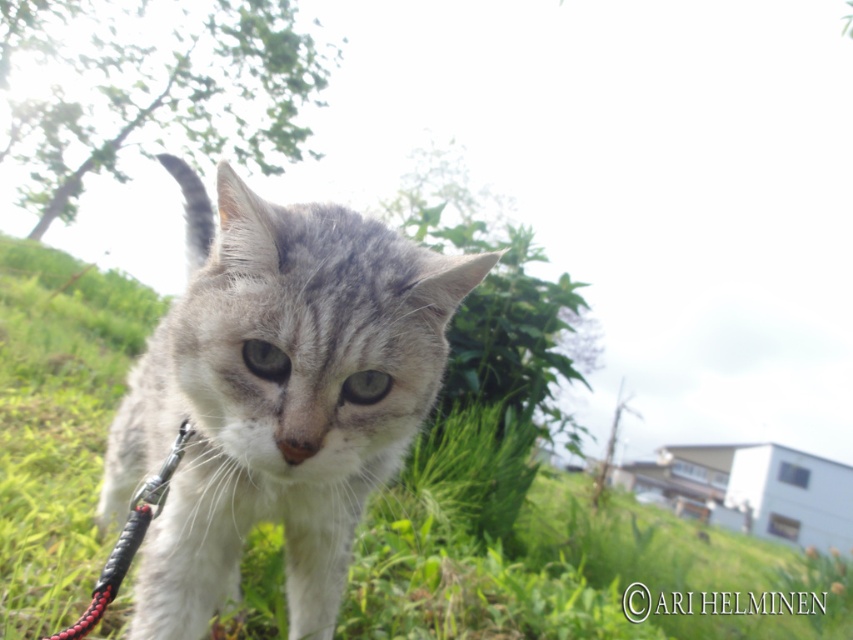
Can you confirm if green grassy at center is positioned to the right of gray fur cat at center?

Yes, green grassy at center is to the right of gray fur cat at center.

Which is more to the right, green grassy at center or gray fur cat at center?

green grassy at center

Consider the image. Measure the distance between green grassy at center and camera.

They are 1.72 meters apart.

The width and height of the screenshot is (853, 640). What are the coordinates of `green grassy at center` in the screenshot? It's located at (548, 556).